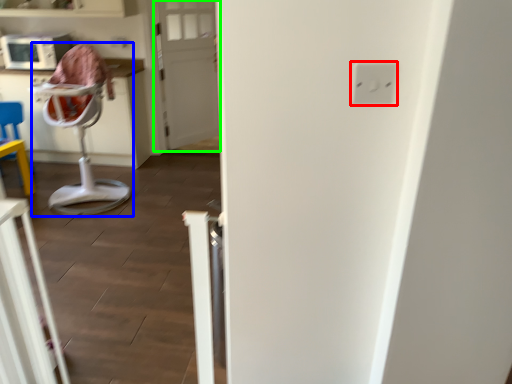
Question: Based on their relative distances, which object is nearer to electric outlet (highlighted by a red box)? Choose from feeding chair (highlighted by a blue box) and door (highlighted by a green box).

Choices:
 (A) feeding chair
 (B) door

Answer: (A)